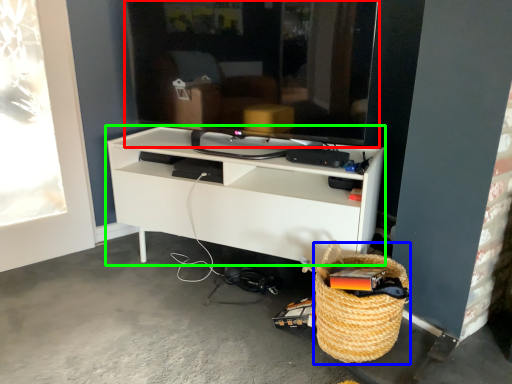
Question: Which object is positioned closest to television (highlighted by a red box)? Select from basket (highlighted by a blue box) and shelf (highlighted by a green box).

Choices:
 (A) basket
 (B) shelf

Answer: (B)